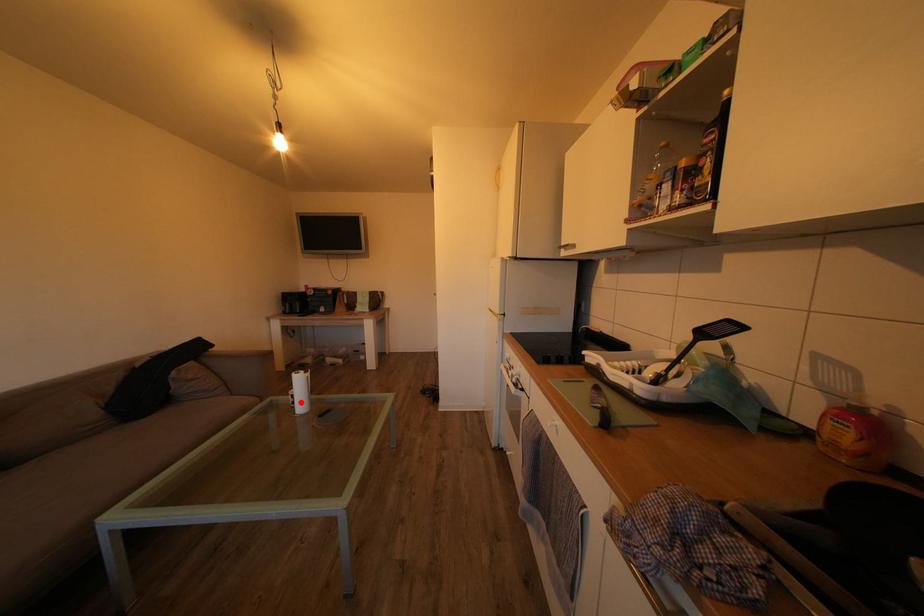
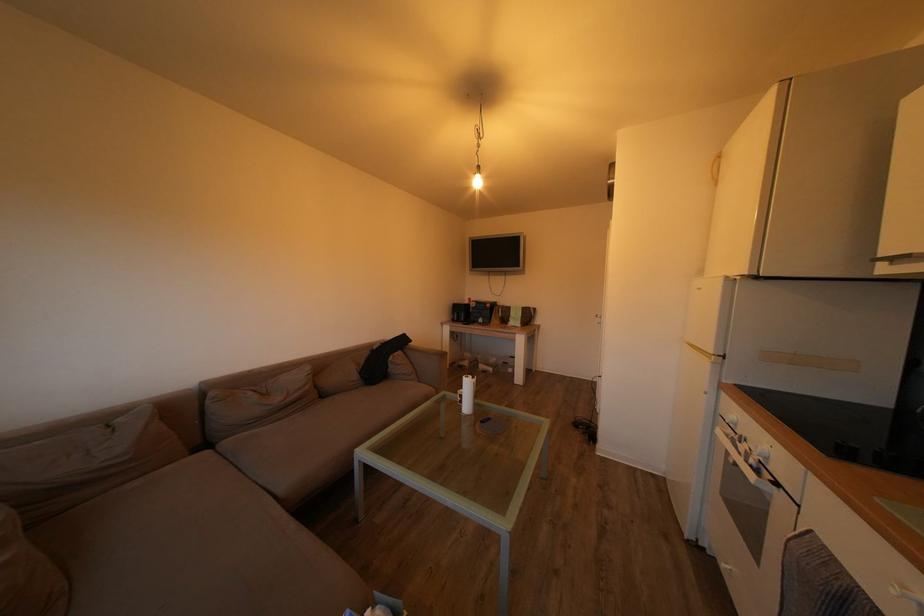
Find the pixel in the second image that matches the highlighted location in the first image.

(468, 402)